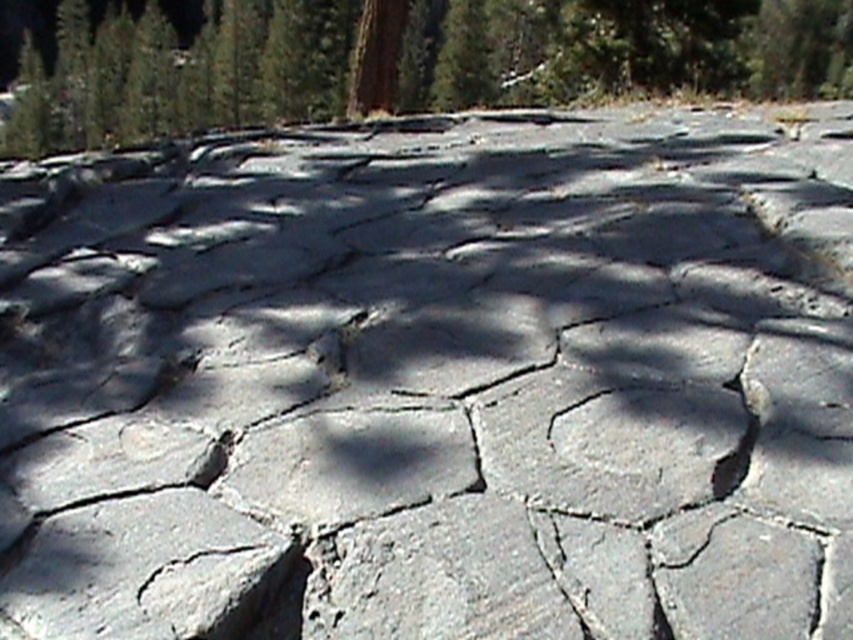
Question: Among these objects, which one is farthest from the camera?

Choices:
 (A) gray rough stone at lower left
 (B) green textured tree at center

Answer: (B)

Question: Does green textured tree at center have a larger size compared to gray rough stone at lower left?

Choices:
 (A) yes
 (B) no

Answer: (A)

Question: Can you confirm if green textured tree at center is wider than gray rough stone at lower left?

Choices:
 (A) yes
 (B) no

Answer: (A)

Question: Among these points, which one is nearest to the camera?

Choices:
 (A) (181, 518)
 (B) (514, 49)

Answer: (A)

Question: Is green textured tree at center wider than gray rough stone at lower left?

Choices:
 (A) no
 (B) yes

Answer: (B)

Question: Which point appears closest to the camera in this image?

Choices:
 (A) (538, 17)
 (B) (102, 557)

Answer: (B)